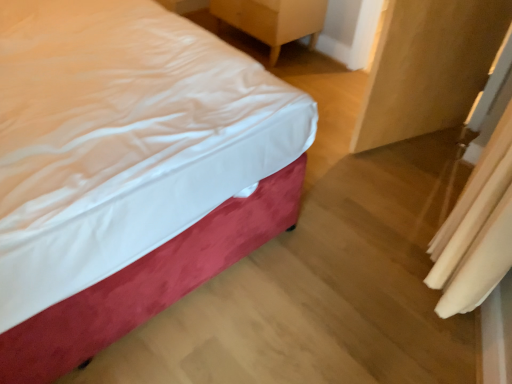
Question: Is white fabric curtain at lower right inside the boundaries of velvet-like red bed at left, or outside?

Choices:
 (A) inside
 (B) outside

Answer: (B)

Question: Based on their positions, is white fabric curtain at lower right located to the left or right of velvet-like red bed at left?

Choices:
 (A) right
 (B) left

Answer: (A)

Question: Estimate the real-world distances between objects in this image. Which object is farther from the wooden nightstand at upper right?

Choices:
 (A) matte wood armoire at right
 (B) velvet-like red bed at left
 (C) white fabric curtain at lower right

Answer: (C)

Question: Estimate the real-world distances between objects in this image. Which object is closer to the wooden nightstand at upper right?

Choices:
 (A) matte wood armoire at right
 (B) velvet-like red bed at left
 (C) white fabric curtain at lower right

Answer: (A)